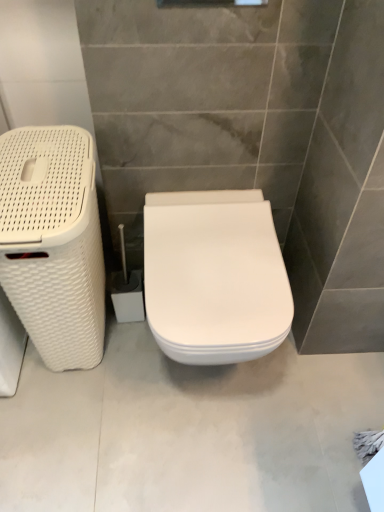
Question: Can you confirm if white glossy toilet at center is bigger than white woven laundry basket at left?

Choices:
 (A) no
 (B) yes

Answer: (A)

Question: Would you say white glossy toilet at center contains white woven laundry basket at left?

Choices:
 (A) yes
 (B) no

Answer: (B)

Question: Could you tell me if white glossy toilet at center is turned towards white woven laundry basket at left?

Choices:
 (A) yes
 (B) no

Answer: (B)

Question: Is white glossy toilet at center oriented away from white woven laundry basket at left?

Choices:
 (A) yes
 (B) no

Answer: (B)

Question: Considering the relative sizes of white glossy toilet at center and white woven laundry basket at left in the image provided, is white glossy toilet at center taller than white woven laundry basket at left?

Choices:
 (A) no
 (B) yes

Answer: (A)

Question: In terms of width, does white glossy toilet at center look wider or thinner when compared to white woven laundry basket at left?

Choices:
 (A) wide
 (B) thin

Answer: (A)

Question: From a real-world perspective, relative to white woven laundry basket at left, is white glossy toilet at center vertically above or below?

Choices:
 (A) below
 (B) above

Answer: (A)

Question: Is point (173, 266) positioned closer to the camera than point (21, 143)?

Choices:
 (A) closer
 (B) farther

Answer: (A)

Question: From their relative heights in the image, would you say white glossy toilet at center is taller or shorter than white woven laundry basket at left?

Choices:
 (A) tall
 (B) short

Answer: (B)

Question: Considering the positions of white glossy toilet at center and white woven laundry basket at left in the image, is white glossy toilet at center taller or shorter than white woven laundry basket at left?

Choices:
 (A) tall
 (B) short

Answer: (B)

Question: Looking at their shapes, would you say white glossy toilet at center is wider or thinner than white woven laundry basket at left?

Choices:
 (A) wide
 (B) thin

Answer: (A)

Question: Relative to white woven laundry basket at left, is white glossy toilet at center in front or behind?

Choices:
 (A) behind
 (B) front

Answer: (A)

Question: From a real-world perspective, is white glossy toilet at center positioned above or below white woven laundry basket at left?

Choices:
 (A) above
 (B) below

Answer: (B)

Question: Looking at the image, does white woven laundry basket at left seem bigger or smaller compared to white glossy toilet at center?

Choices:
 (A) small
 (B) big

Answer: (B)

Question: Relative to white glossy toilet at center, is white woven laundry basket at left in front or behind?

Choices:
 (A) front
 (B) behind

Answer: (A)